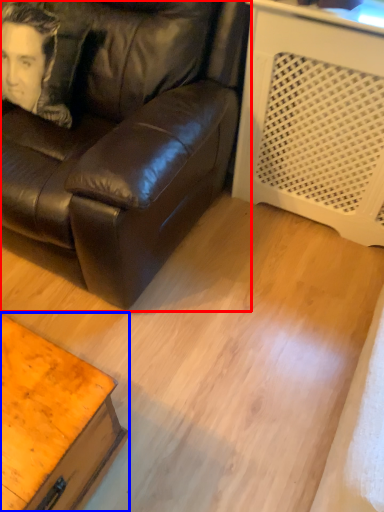
Question: Which point is further to the camera, studio couch (highlighted by a red box) or table (highlighted by a blue box)?

Choices:
 (A) studio couch
 (B) table

Answer: (A)